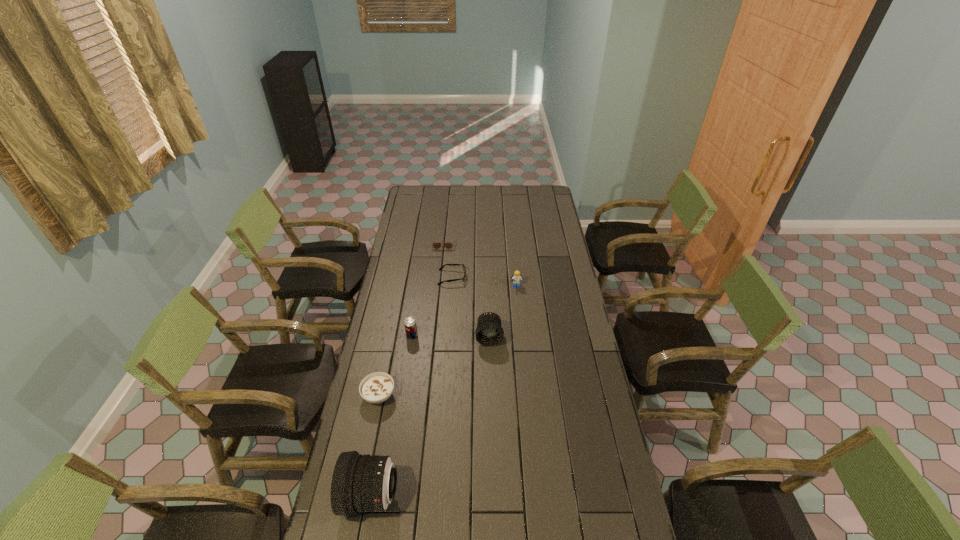
What are the coordinates of `free point that keeps the telephoto lenss evenly spaced on the right` in the screenshot? It's located at (558, 244).